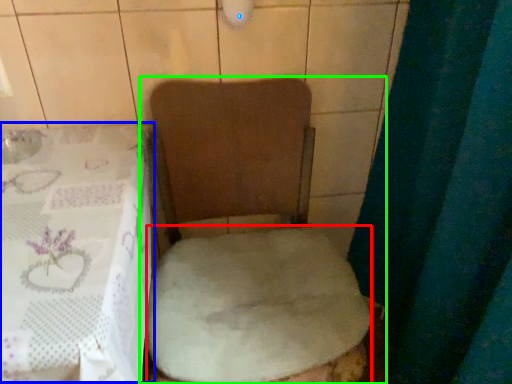
Question: Based on their relative distances, which object is farther from sheet (highlighted by a red box)? Choose from table (highlighted by a blue box) and toilet (highlighted by a green box).

Choices:
 (A) table
 (B) toilet

Answer: (A)